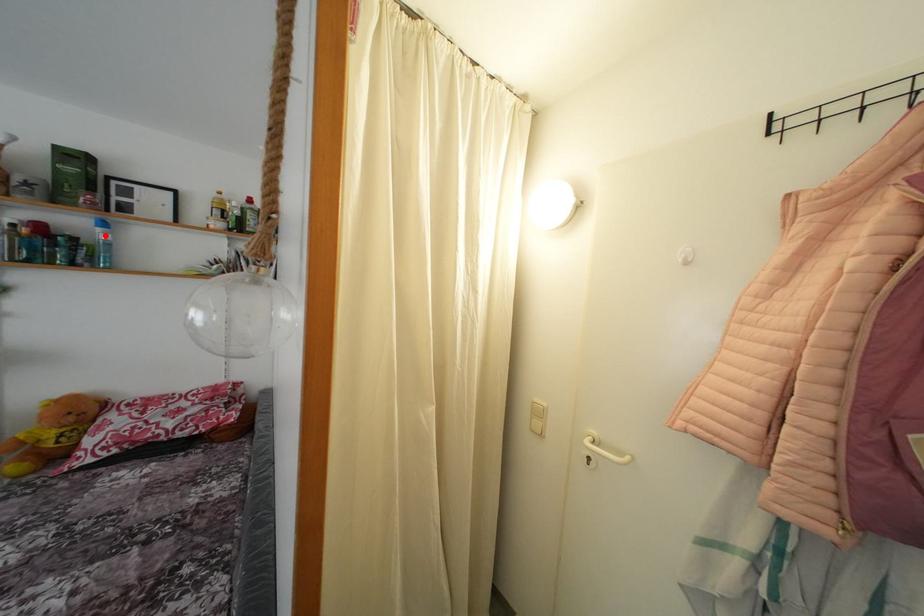
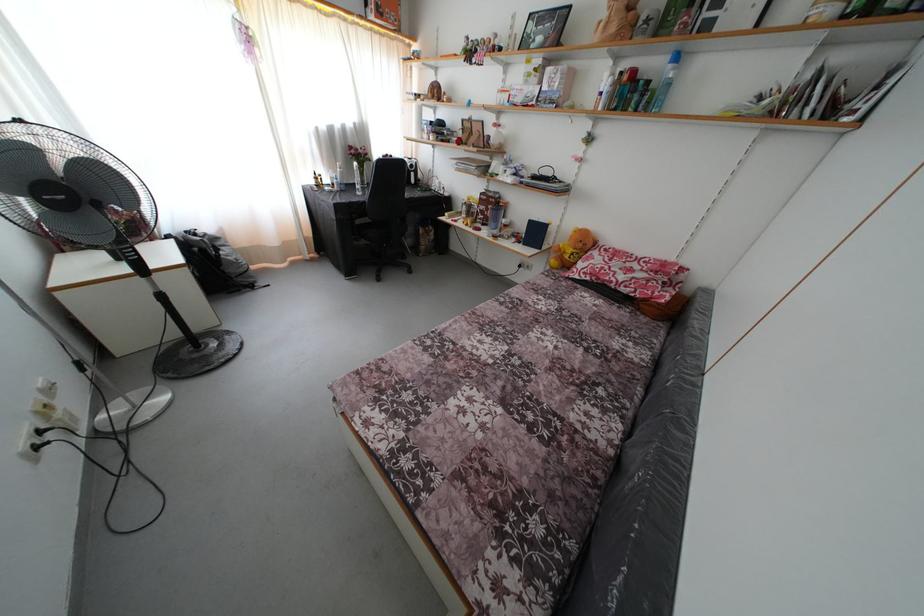
In the second image, find the point that corresponds to the highlighted location in the first image.

(675, 73)